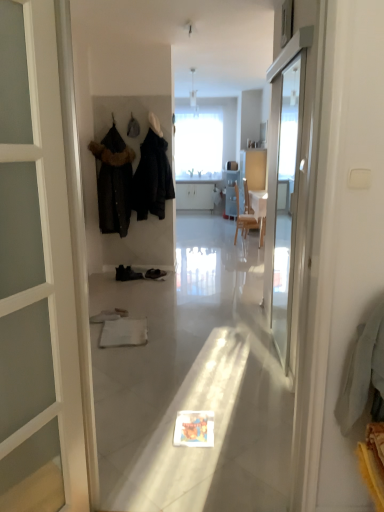
Question: Is transparent glass screen door at right taller than black fur-trimmed coat at left, which ranks as the first clothing in left-to-right order?

Choices:
 (A) yes
 (B) no

Answer: (A)

Question: Is black fur-trimmed coat at left, which ranks as the first clothing in left-to-right order, completely or partially inside transparent glass screen door at right?

Choices:
 (A) yes
 (B) no

Answer: (B)

Question: From the image's perspective, is transparent glass screen door at right above black fur-trimmed coat at left, the 2th clothing positioned from the right?

Choices:
 (A) yes
 (B) no

Answer: (B)

Question: Is transparent glass screen door at right in contact with black fur-trimmed coat at left, which ranks as the first clothing in left-to-right order?

Choices:
 (A) yes
 (B) no

Answer: (B)

Question: Does transparent glass screen door at right lie in front of black fur-trimmed coat at left, which ranks as the first clothing in left-to-right order?

Choices:
 (A) yes
 (B) no

Answer: (A)

Question: Which is correct: black fur-trimmed coat at left, which ranks as the first clothing in left-to-right order, is inside transparent glass screen door at right, or outside of it?

Choices:
 (A) inside
 (B) outside

Answer: (B)

Question: Based on their positions, is black fur-trimmed coat at left, which ranks as the first clothing in left-to-right order, located to the left or right of transparent glass screen door at right?

Choices:
 (A) left
 (B) right

Answer: (A)

Question: Is point (119, 173) positioned closer to the camera than point (294, 246)?

Choices:
 (A) closer
 (B) farther

Answer: (B)

Question: From the image's perspective, is black fur-trimmed coat at left, the 2th clothing positioned from the right, above or below transparent glass screen door at right?

Choices:
 (A) below
 (B) above

Answer: (B)

Question: Based on their positions, is transparent glass screen door at right located to the left or right of dark matte coat at center, which ranks as the first clothing in right-to-left order?

Choices:
 (A) left
 (B) right

Answer: (B)

Question: Looking at the image, does transparent glass screen door at right seem bigger or smaller compared to dark matte coat at center, which ranks as the first clothing in right-to-left order?

Choices:
 (A) big
 (B) small

Answer: (B)

Question: From the image's perspective, is transparent glass screen door at right located above or below dark matte coat at center, placed as the 2th clothing when sorted from left to right?

Choices:
 (A) below
 (B) above

Answer: (A)

Question: Is transparent glass screen door at right taller or shorter than dark matte coat at center, which ranks as the first clothing in right-to-left order?

Choices:
 (A) tall
 (B) short

Answer: (A)

Question: From the image's perspective, relative to black fur-trimmed coat at left, the 2th clothing positioned from the right, is dark matte coat at center, placed as the 2th clothing when sorted from left to right, above or below?

Choices:
 (A) above
 (B) below

Answer: (A)

Question: Based on their positions, is dark matte coat at center, which ranks as the first clothing in right-to-left order, located to the left or right of black fur-trimmed coat at left, which ranks as the first clothing in left-to-right order?

Choices:
 (A) left
 (B) right

Answer: (B)